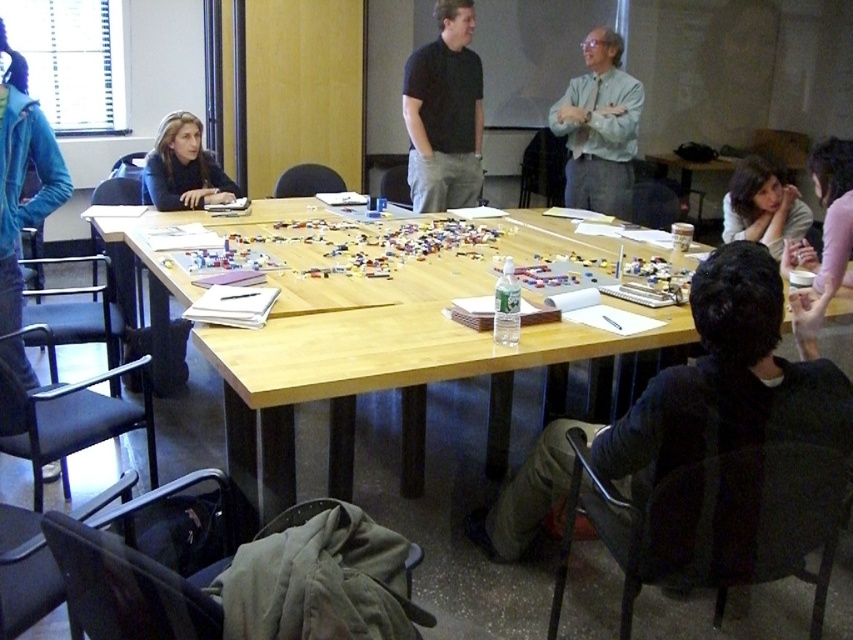
Looking at this image, is dark gray fabric jacket at lower right above light brown hair at lower right?

No, dark gray fabric jacket at lower right is not above light brown hair at lower right.

Who is more forward, (614, 470) or (750, 240)?

Point (614, 470) is more forward.

You are a GUI agent. You are given a task and a screenshot of the screen. Output one action in this format:
    pyautogui.click(x=<x>, y=<y>)
    Task: Click on the dark gray fabric jacket at lower right
    Image resolution: width=853 pixels, height=640 pixels.
    Given the screenshot: What is the action you would take?
    pyautogui.click(x=688, y=403)

Is light wood table at center closer to the viewer compared to light blue shirt at center?

Yes, it is in front of light blue shirt at center.

Measure the distance between light wood table at center and camera.

5.74 feet

This screenshot has width=853, height=640. Find the location of `light wood table at center`. light wood table at center is located at coordinates (381, 371).

Is point (704, 385) more distant than point (579, 115)?

No, it is not.

This screenshot has height=640, width=853. What are the coordinates of `dark gray fabric jacket at lower right` in the screenshot? It's located at (688, 403).

This screenshot has width=853, height=640. I want to click on dark gray fabric jacket at lower right, so click(x=688, y=403).